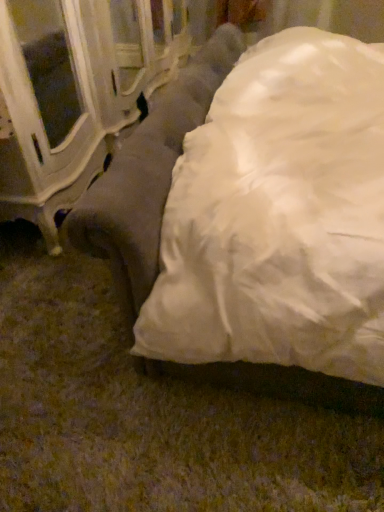
Question: Should I look upward or downward to see suede-like gray couch at center?

Choices:
 (A) up
 (B) down

Answer: (A)

Question: Would you say suede-like gray couch at center is part of white glossy cabinet at left's contents?

Choices:
 (A) yes
 (B) no

Answer: (B)

Question: Does white glossy cabinet at left appear on the left side of suede-like gray couch at center?

Choices:
 (A) no
 (B) yes

Answer: (B)

Question: Is white glossy cabinet at left located outside suede-like gray couch at center?

Choices:
 (A) yes
 (B) no

Answer: (A)

Question: Is white glossy cabinet at left with suede-like gray couch at center?

Choices:
 (A) no
 (B) yes

Answer: (A)

Question: From the image's perspective, is white glossy cabinet at left below suede-like gray couch at center?

Choices:
 (A) yes
 (B) no

Answer: (B)

Question: Is white glossy cabinet at left positioned in front of suede-like gray couch at center?

Choices:
 (A) yes
 (B) no

Answer: (B)

Question: Considering the relative sizes of suede-like gray couch at center and white glossy cabinet at left in the image provided, is suede-like gray couch at center smaller than white glossy cabinet at left?

Choices:
 (A) yes
 (B) no

Answer: (B)

Question: Is suede-like gray couch at center surrounding white glossy cabinet at left?

Choices:
 (A) yes
 (B) no

Answer: (B)

Question: Is suede-like gray couch at center facing towards white glossy cabinet at left?

Choices:
 (A) no
 (B) yes

Answer: (B)

Question: Is white glossy cabinet at left at the back of suede-like gray couch at center?

Choices:
 (A) no
 (B) yes

Answer: (A)

Question: Can you confirm if suede-like gray couch at center is thinner than white glossy cabinet at left?

Choices:
 (A) no
 (B) yes

Answer: (A)

Question: From the image's perspective, is suede-like gray couch at center located beneath white glossy cabinet at left?

Choices:
 (A) no
 (B) yes

Answer: (B)

Question: In terms of height, does white glossy cabinet at left look taller or shorter compared to suede-like gray couch at center?

Choices:
 (A) tall
 (B) short

Answer: (B)